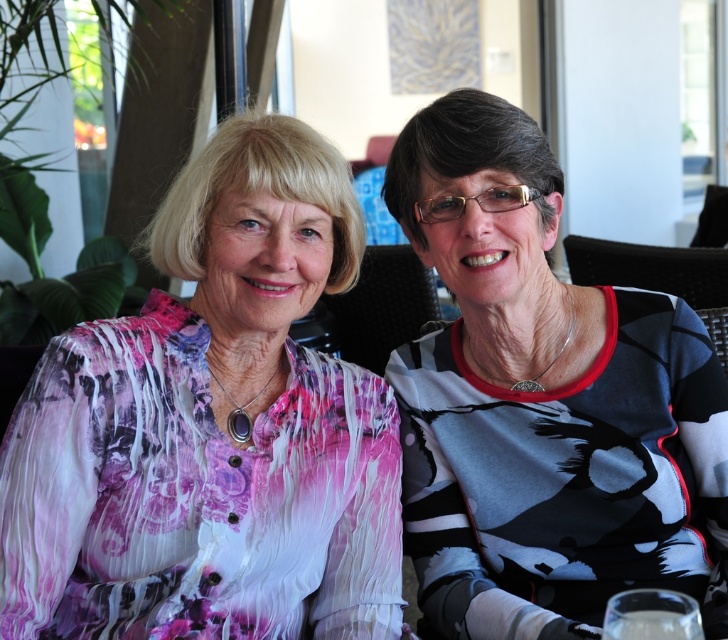
You are taking a photo of two women sitting at a table in a cafe. You want to focus on the point closer to the camera between the two points labeled as point (x=170, y=376) and point (x=467, y=97). Which point should you focus on?

You should focus on point (x=170, y=376) because it is closer to the camera than point (x=467, y=97).

You are a tailor who needs to create a new outfit based on the two women in the image. If you want to design a blouse that combines the style of the pink floral blouse at left and the black and white printed shirt at right, which part of the design should you prioritize in terms of width to ensure it looks balanced?

The pink floral blouse at left is wider than the black and white printed shirt at right, so to create a balanced design, prioritize maintaining the width of the pink floral blouse at left while incorporating the black and white printed shirt at right elements.

You are a photographer trying to capture a clear shot of both the pink floral blouse at left and the black and white printed shirt at right. Based on their positions, which one is closer to the camera?

The pink floral blouse at left is closer to the camera since it is in front of the black and white printed shirt at right.